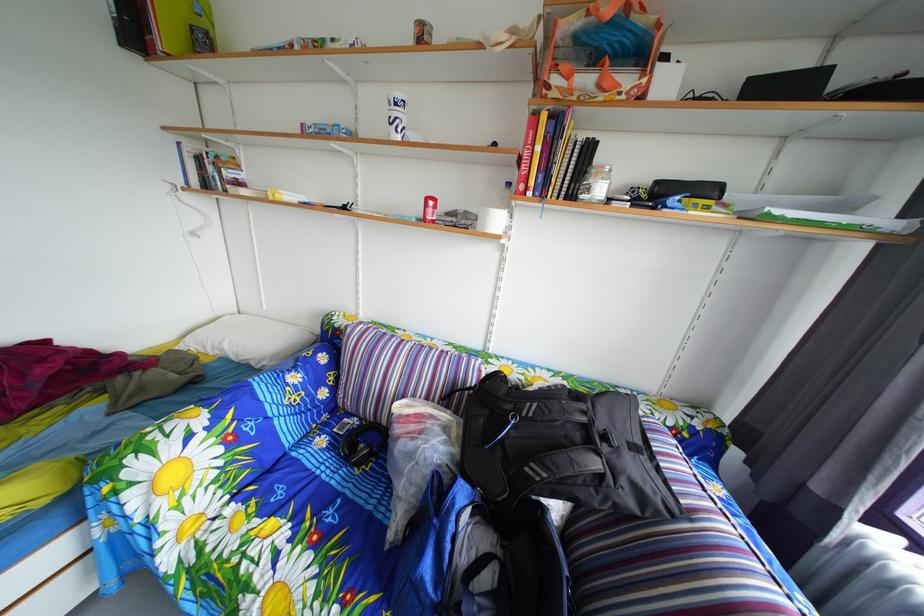
The image size is (924, 616). Find the location of `blue zipper pull`. blue zipper pull is located at coordinates (504, 429).